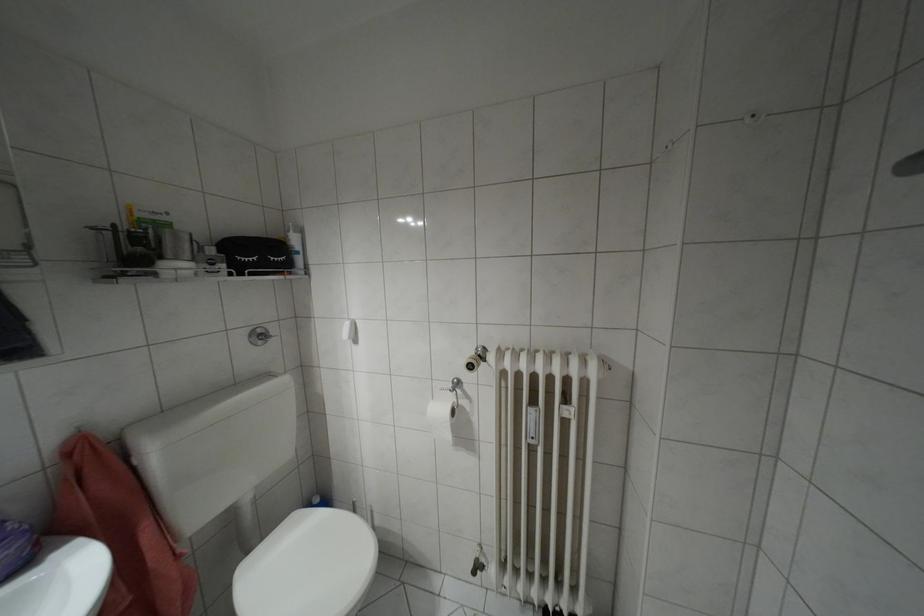
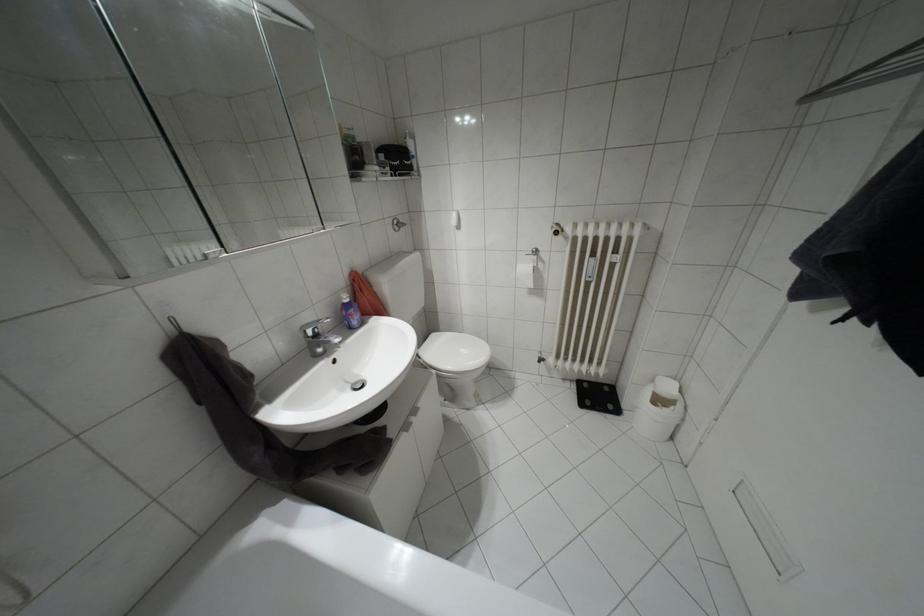
The point at (260,341) is marked in the first image. Where is the corresponding point in the second image?

(395, 229)